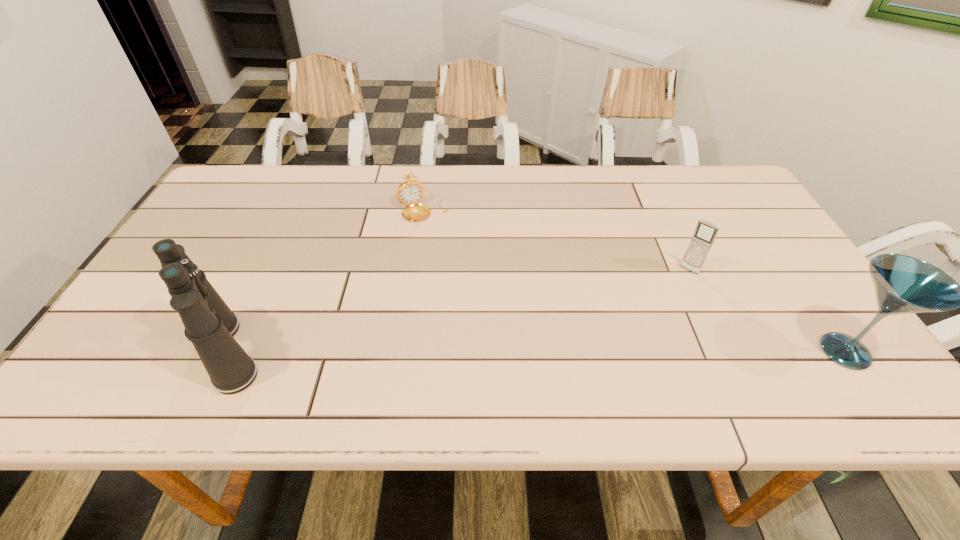
Locate an element on the screen. object positioned at the near right corner is located at coordinates (903, 284).

Locate an element on the screen. Image resolution: width=960 pixels, height=540 pixels. vacant space at the far edge is located at coordinates point(653,198).

In the image, there is a desktop. Where is `vacant space at the near edge`? vacant space at the near edge is located at coordinates (781, 366).

Find the location of a particular element. This screenshot has height=540, width=960. blank space at the right edge of the desktop is located at coordinates (738, 211).

You are a GUI agent. You are given a task and a screenshot of the screen. Output one action in this format:
    pyautogui.click(x=<x>, y=<y>)
    Task: Click on the vacant area between the binoculars and the farthest object
    
    Given the screenshot: What is the action you would take?
    pyautogui.click(x=325, y=280)

The image size is (960, 540). Identify the location of empty location between the binoculars and the farthest object. (325, 280).

Identify the location of free point between the tallest object and the pocket watch. This screenshot has height=540, width=960. (325, 280).

Find the location of a particular element. free space between the third shortest object and the binoculars is located at coordinates (537, 352).

Where is `free space that is in between the pocket watch and the tallest object`? This screenshot has width=960, height=540. free space that is in between the pocket watch and the tallest object is located at coordinates (325, 280).

The height and width of the screenshot is (540, 960). What are the coordinates of `vacant region between the martini and the leftmost object` in the screenshot? It's located at (537, 352).